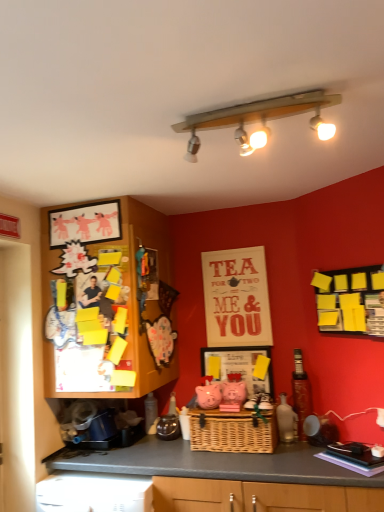
Image resolution: width=384 pixels, height=512 pixels. What are the coordinates of `vacant space underneath yellow sticky notes at upper right (from a real-world perspective)` in the screenshot? It's located at pos(365,440).